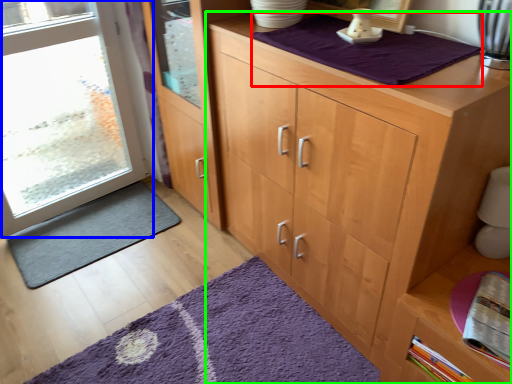
Question: Considering the real-world distances, which object is closest to blanket (highlighted by a red box)? door (highlighted by a blue box) or cupboard (highlighted by a green box).

Choices:
 (A) door
 (B) cupboard

Answer: (B)